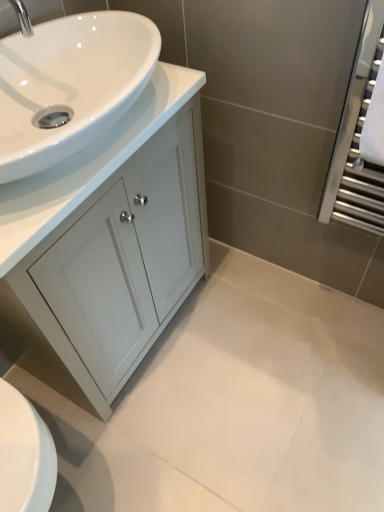
What do you see at coordinates (69, 85) in the screenshot? This screenshot has width=384, height=512. I see `white glossy sink at upper left` at bounding box center [69, 85].

Locate an element on the screen. Image resolution: width=384 pixels, height=512 pixels. silver metallic tap at upper left is located at coordinates click(23, 17).

Does white glossy cabinet at left appear on the left side of silver metallic tap at upper left?

Incorrect, white glossy cabinet at left is not on the left side of silver metallic tap at upper left.

Does white glossy cabinet at left touch silver metallic tap at upper left?

No, white glossy cabinet at left is not beside silver metallic tap at upper left.

How different are the orientations of white glossy cabinet at left and silver metallic tap at upper left in degrees?

The facing directions of white glossy cabinet at left and silver metallic tap at upper left are 1.81 degrees apart.

Does white glossy cabinet at left have a greater height compared to silver metallic tap at upper left?

Yes.

Is silver metallic tap at upper left shorter than white glossy cabinet at left?

Yes.

Would you consider silver metallic tap at upper left to be distant from white glossy cabinet at left?

No.

From a real-world perspective, is silver metallic tap at upper left positioned under white glossy cabinet at left based on gravity?

No, from a real-world perspective, silver metallic tap at upper left is not under white glossy cabinet at left.

Is silver metallic tap at upper left facing towards white glossy cabinet at left?

No, silver metallic tap at upper left is not turned towards white glossy cabinet at left.

Is white glossy sink at upper left thinner than silver metallic tap at upper left?

No, white glossy sink at upper left is not thinner than silver metallic tap at upper left.

Is white glossy sink at upper left facing towards silver metallic tap at upper left?

No.

Who is more distant, white glossy sink at upper left or silver metallic tap at upper left?

silver metallic tap at upper left is further from the camera.

Between white glossy sink at upper left and silver metallic tap at upper left, which one appears on the left side from the viewer's perspective?

From the viewer's perspective, silver metallic tap at upper left appears more on the left side.

Find the location of a particular element. bathroom cabinet located on the right of white glossy sink at upper left is located at coordinates (113, 236).

Which object is positioned more to the left, white glossy cabinet at left or white glossy sink at upper left?

Positioned to the left is white glossy sink at upper left.

Is white glossy cabinet at left looking in the opposite direction of white glossy sink at upper left?

No, white glossy cabinet at left is not facing the opposite direction of white glossy sink at upper left.

Who is shorter, white glossy sink at upper left or white glossy cabinet at left?

white glossy sink at upper left is shorter.

In terms of size, does white glossy sink at upper left appear bigger or smaller than white glossy cabinet at left?

white glossy sink at upper left is smaller than white glossy cabinet at left.

How much distance is there between white glossy sink at upper left and white glossy cabinet at left?

white glossy sink at upper left is 23.81 centimeters away from white glossy cabinet at left.

Looking at this image, does white glossy sink at upper left touch white glossy cabinet at left?

No, white glossy sink at upper left is not making contact with white glossy cabinet at left.

Is point (17, 15) positioned in front of point (105, 40)?

Yes, it is in front of point (105, 40).

Is silver metallic tap at upper left completely or partially outside of white glossy sink at upper left?

That's correct, silver metallic tap at upper left is outside of white glossy sink at upper left.

Does silver metallic tap at upper left have a greater height compared to white glossy sink at upper left?

No.

Which of these two, silver metallic tap at upper left or white glossy sink at upper left, is thinner?

Thinner between the two is silver metallic tap at upper left.

Locate an element on the screen. This screenshot has width=384, height=512. bathroom cabinet lying below the silver metallic tap at upper left (from the image's perspective) is located at coordinates (113, 236).

Find the location of a particular element. This screenshot has width=384, height=512. tap above the white glossy cabinet at left (from a real-world perspective) is located at coordinates (23, 17).

Considering their positions, is white glossy cabinet at left positioned further to white glossy sink at upper left than silver metallic tap at upper left?

Among the two, white glossy cabinet at left is located further to white glossy sink at upper left.

Based on their spatial positions, is white glossy sink at upper left or white glossy cabinet at left closer to silver metallic tap at upper left?

The object closer to silver metallic tap at upper left is white glossy sink at upper left.

Consider the image. From the image, which object appears to be farther from silver metallic tap at upper left, white glossy cabinet at left or white glossy sink at upper left?

Among the two, white glossy cabinet at left is located further to silver metallic tap at upper left.

When comparing their distances from white glossy cabinet at left, does white glossy sink at upper left or silver metallic tap at upper left seem further?

Based on the image, silver metallic tap at upper left appears to be further to white glossy cabinet at left.

Based on their spatial positions, is silver metallic tap at upper left or white glossy sink at upper left closer to white glossy cabinet at left?

white glossy sink at upper left is closer to white glossy cabinet at left.

Considering their positions, is silver metallic tap at upper left positioned closer to white glossy sink at upper left than white glossy cabinet at left?

silver metallic tap at upper left is positioned closer to the anchor white glossy sink at upper left.

At what (x,y) coordinates should I click in order to perform the action: click on sink that lies between silver metallic tap at upper left and white glossy cabinet at left from top to bottom. Please return your answer as a coordinate pair (x, y). Looking at the image, I should click on (69, 85).